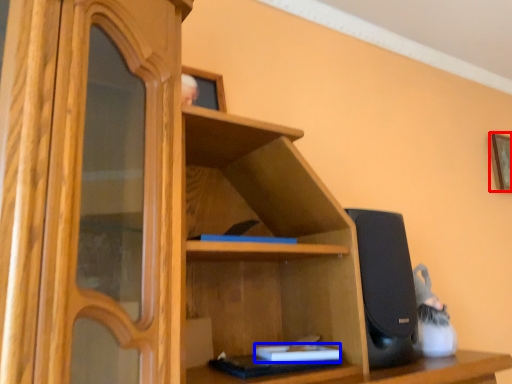
Question: Which point is further to the camera, picture frame (highlighted by a red box) or book (highlighted by a blue box)?

Choices:
 (A) picture frame
 (B) book

Answer: (A)